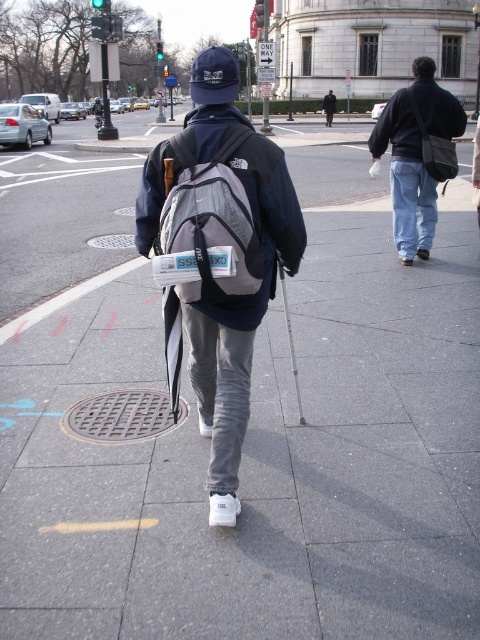
Question: Which of the following is the farthest from the observer?

Choices:
 (A) (208, 342)
 (B) (324, 100)
 (C) (412, 100)
 (D) (242, 253)

Answer: (B)

Question: Estimate the real-world distances between objects in this image. Which object is farther from the matte gray backpack at center?

Choices:
 (A) gray mesh backpack at center
 (B) denim jacket at center
 (C) dark blue fabric jacket at center

Answer: (C)

Question: Can you confirm if gray mesh backpack at center is positioned to the left of dark blue fabric jacket at center?

Choices:
 (A) yes
 (B) no

Answer: (A)

Question: Based on their relative distances, which object is nearer to the dark blue fabric jacket at center?

Choices:
 (A) gray mesh backpack at center
 (B) matte gray backpack at center

Answer: (B)

Question: Is matte gray backpack at center wider than gray mesh backpack at center?

Choices:
 (A) yes
 (B) no

Answer: (A)

Question: Is denim jacket at center to the left of dark blue fabric jacket at center from the viewer's perspective?

Choices:
 (A) yes
 (B) no

Answer: (A)